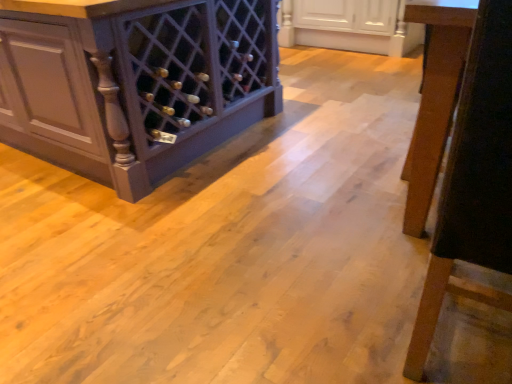
Locate an element on the screen. This screenshot has height=384, width=512. vacant area that is in front of matte dark wood wine rack at left, the 1th cabinetry from the left is located at coordinates (172, 240).